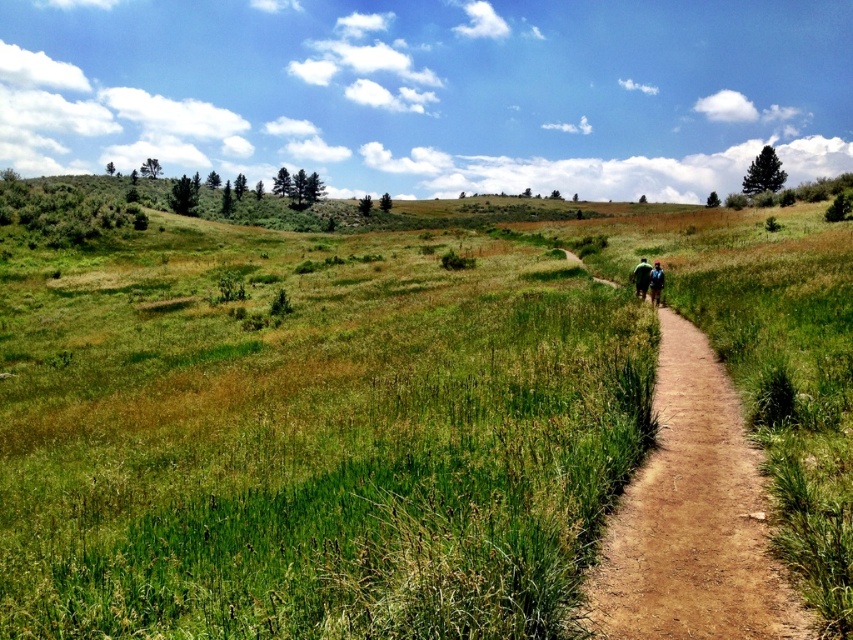
Question: Estimate the real-world distances between objects in this image. Which object is farther from the green fabric jacket at center?

Choices:
 (A) brown dirt path at center
 (B) green fabric jacket at center-right

Answer: (A)

Question: Considering the real-world distances, which object is farthest from the brown dirt path at center?

Choices:
 (A) green grass at center
 (B) green fabric jacket at center

Answer: (A)

Question: Is green fabric jacket at center wider than green fabric jacket at center-right?

Choices:
 (A) yes
 (B) no

Answer: (A)

Question: From the image, what is the correct spatial relationship of green grass at center in relation to green fabric jacket at center-right?

Choices:
 (A) right
 (B) left

Answer: (B)

Question: Can you confirm if green fabric jacket at center is thinner than green fabric jacket at center-right?

Choices:
 (A) yes
 (B) no

Answer: (B)

Question: Which object is the farthest from the green fabric jacket at center-right?

Choices:
 (A) green fabric jacket at center
 (B) green grass at center
 (C) brown dirt path at center

Answer: (B)